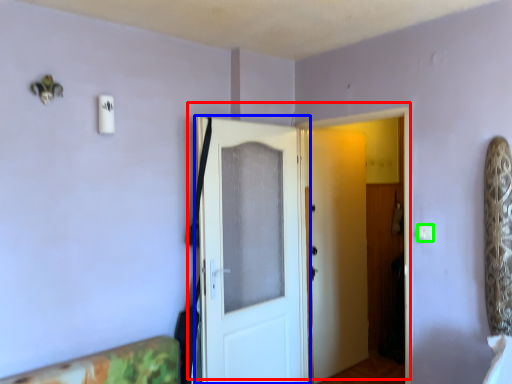
Question: Estimate the real-world distances between objects in this image. Which object is closer to door (highlighted by a red box), door (highlighted by a blue box) or light switch (highlighted by a green box)?

Choices:
 (A) door
 (B) light switch

Answer: (A)